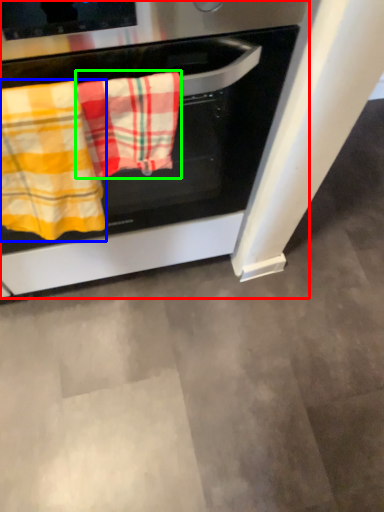
Question: Considering the real-world distances, which object is closest to oven (highlighted by a red box)? beach towel (highlighted by a blue box) or beach towel (highlighted by a green box).

Choices:
 (A) beach towel
 (B) beach towel

Answer: (B)